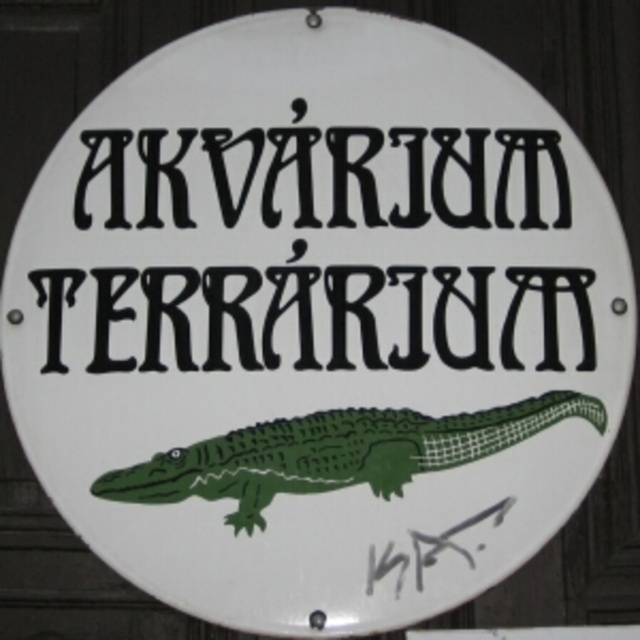
Question: Which of the following is the farthest from the observer?

Choices:
 (A) (157, 172)
 (B) (426, 416)

Answer: (A)

Question: Can you confirm if blackmaterial/texturetext at upper center is bigger than green matte crocodile at center?

Choices:
 (A) yes
 (B) no

Answer: (B)

Question: Is blackmaterial/texturetext at upper center smaller than green matte crocodile at center?

Choices:
 (A) yes
 (B) no

Answer: (A)

Question: Does blackmaterial/texturetext at upper center come behind green matte crocodile at center?

Choices:
 (A) no
 (B) yes

Answer: (B)

Question: Which point is farther to the camera?

Choices:
 (A) green matte crocodile at center
 (B) blackmaterial/texturetext at upper center

Answer: (B)